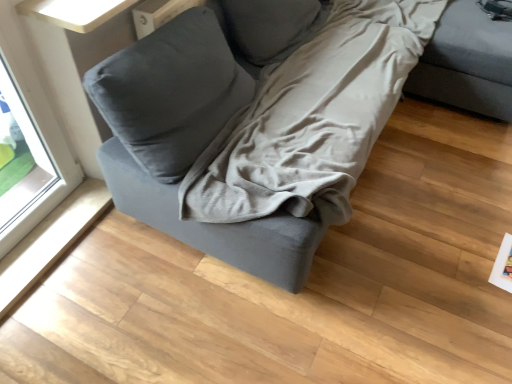
What do you see at coordinates (74, 12) in the screenshot? The height and width of the screenshot is (384, 512). I see `white glossy table at upper left` at bounding box center [74, 12].

You are a GUI agent. You are given a task and a screenshot of the screen. Output one action in this format:
    pyautogui.click(x=<x>, y=<y>)
    Task: Click on the white glossy table at upper left
    
    Given the screenshot: What is the action you would take?
    pyautogui.click(x=74, y=12)

Where is `white glossy table at upper left`? white glossy table at upper left is located at coordinates (74, 12).